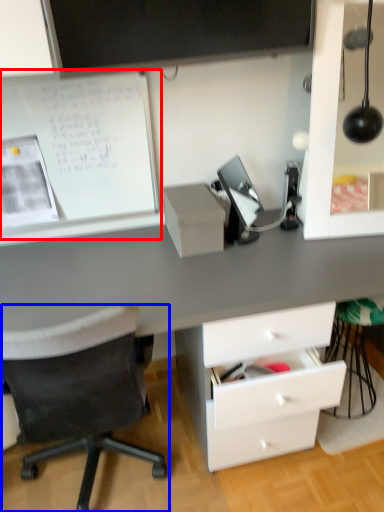
Question: Which object appears farthest to the camera in this image, bulletin board (highlighted by a red box) or chair (highlighted by a blue box)?

Choices:
 (A) bulletin board
 (B) chair

Answer: (A)